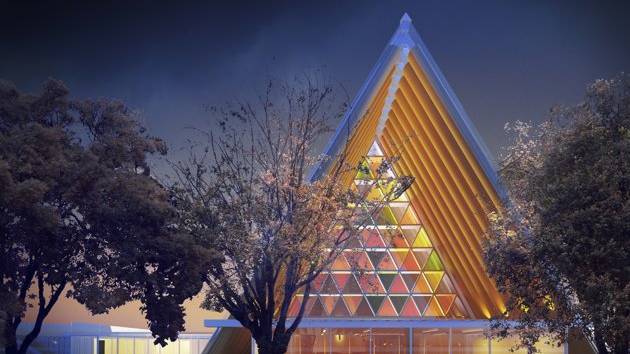
The height and width of the screenshot is (354, 630). Identify the location of center of glass windows. (377, 243).